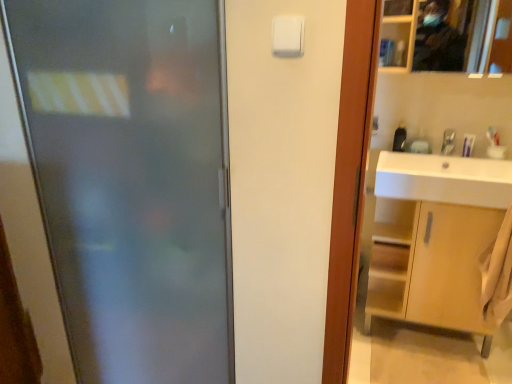
Question: Should I look upward or downward to see silver metallic faucet at upper right?

Choices:
 (A) down
 (B) up

Answer: (B)

Question: From a real-world perspective, is metallic reflective mirror at upper right on silver metallic faucet at upper right?

Choices:
 (A) yes
 (B) no

Answer: (A)

Question: Could silver metallic faucet at upper right be considered to be inside metallic reflective mirror at upper right?

Choices:
 (A) no
 (B) yes

Answer: (A)

Question: Considering the relative sizes of metallic reflective mirror at upper right and silver metallic faucet at upper right in the image provided, is metallic reflective mirror at upper right thinner than silver metallic faucet at upper right?

Choices:
 (A) yes
 (B) no

Answer: (B)

Question: Is metallic reflective mirror at upper right looking in the opposite direction of silver metallic faucet at upper right?

Choices:
 (A) yes
 (B) no

Answer: (B)

Question: Is metallic reflective mirror at upper right taller than silver metallic faucet at upper right?

Choices:
 (A) no
 (B) yes

Answer: (B)

Question: From the image's perspective, does metallic reflective mirror at upper right appear lower than silver metallic faucet at upper right?

Choices:
 (A) yes
 (B) no

Answer: (B)

Question: Is white plastic light switch at upper center inside frosted glass door at left?

Choices:
 (A) no
 (B) yes

Answer: (A)

Question: Is frosted glass door at left aimed at white plastic light switch at upper center?

Choices:
 (A) yes
 (B) no

Answer: (B)

Question: Is frosted glass door at left not within white plastic light switch at upper center?

Choices:
 (A) yes
 (B) no

Answer: (A)

Question: From the image's perspective, is frosted glass door at left beneath white plastic light switch at upper center?

Choices:
 (A) yes
 (B) no

Answer: (A)

Question: Is frosted glass door at left taller than white plastic light switch at upper center?

Choices:
 (A) yes
 (B) no

Answer: (A)

Question: Is the depth of frosted glass door at left greater than that of white plastic light switch at upper center?

Choices:
 (A) no
 (B) yes

Answer: (B)

Question: Considering the relative sizes of silver metallic faucet at upper right and frosted glass door at left in the image provided, is silver metallic faucet at upper right thinner than frosted glass door at left?

Choices:
 (A) yes
 (B) no

Answer: (A)